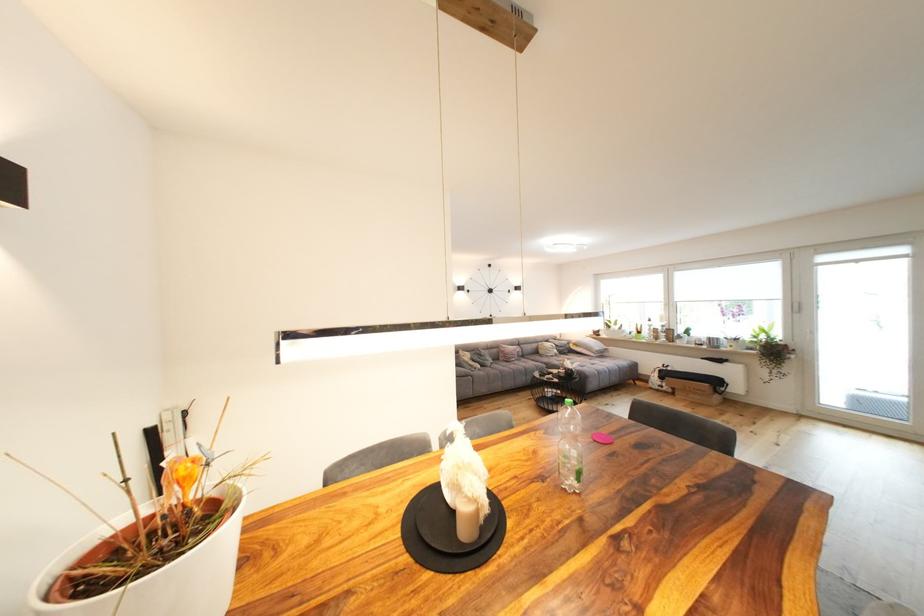
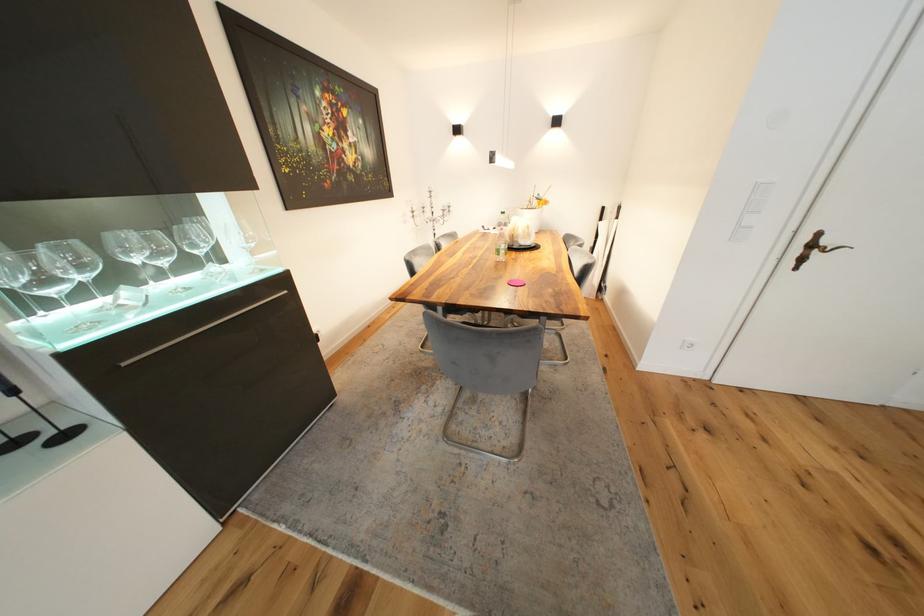
Locate, in the second image, the point that corresponds to the point at 581,455 in the first image.

(511, 248)